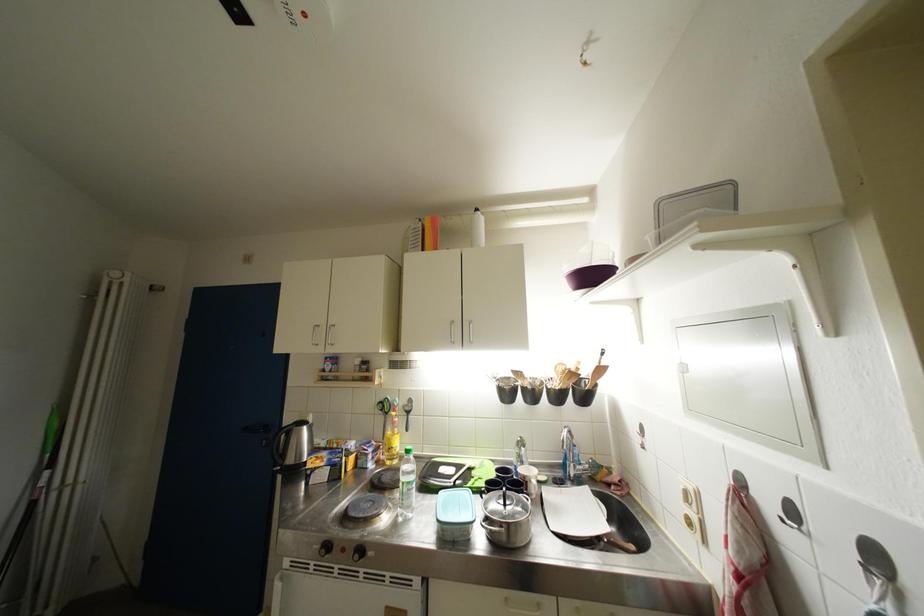
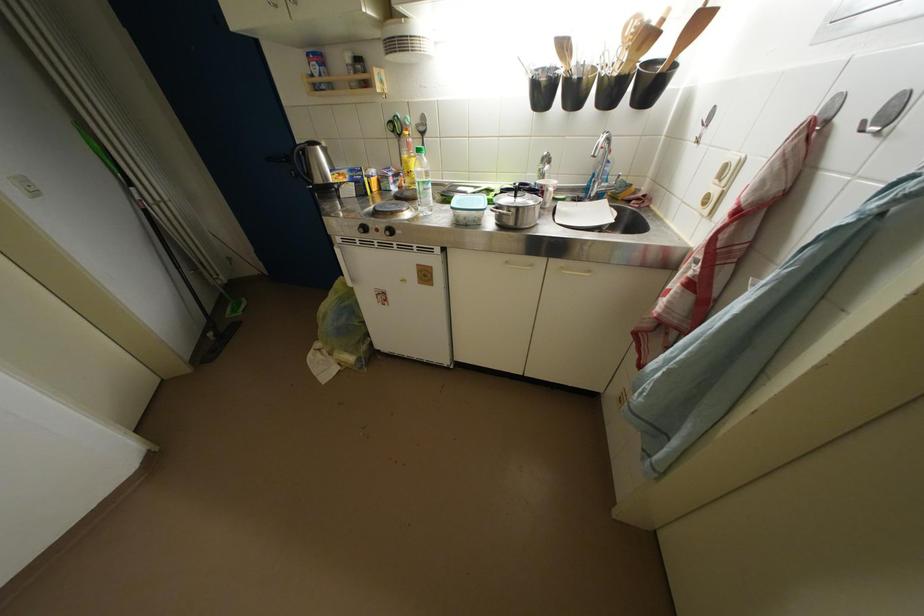
Where in the second image is the point corresponding to the point at 50,488 from the first image?

(144, 201)